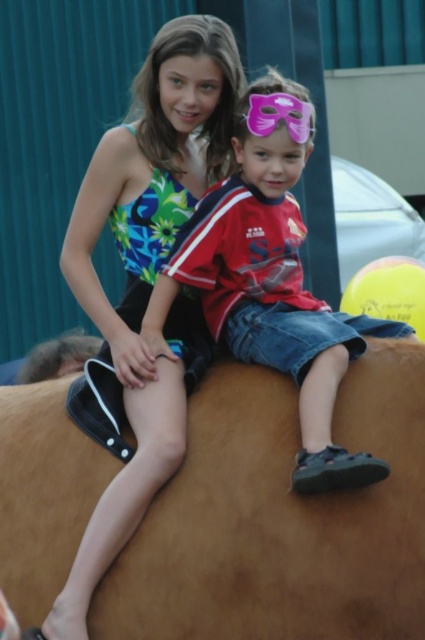
You are a photographer standing in front of the scene. You want to take a photo of both the brown leather horse at center and the matte red shirt at center. Which object should you focus on first to ensure it appears sharp in the photo?

You should focus on the brown leather horse at center first because it is closer to you than the matte red shirt at center, so focusing on it will keep it sharp while the background may blur.

Please look at the image and tell me what object is located at the coordinates point (280, 518). The scene includes two children sitting on a large light brown textured object that looks like a horse.

The object at point (280, 518) is the brown leather horse at center.

You are a photographer trying to capture a clear shot of both the multicolored fabric dress at upper left and the matte red shirt at center. Which object should you focus on first to ensure it appears sharp in the photo?

The multicolored fabric dress at upper left is closer to the viewer than the matte red shirt at center, so you should focus on the multicolored fabric dress at upper left first to ensure it appears sharp.